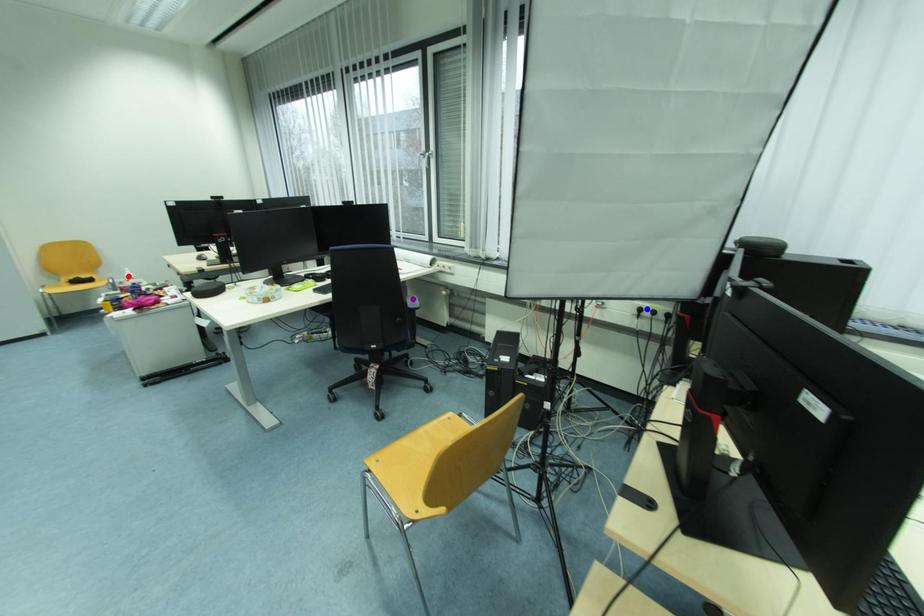
Order these from nearest to farthest:
- blue point
- red point
- purple point

red point, purple point, blue point